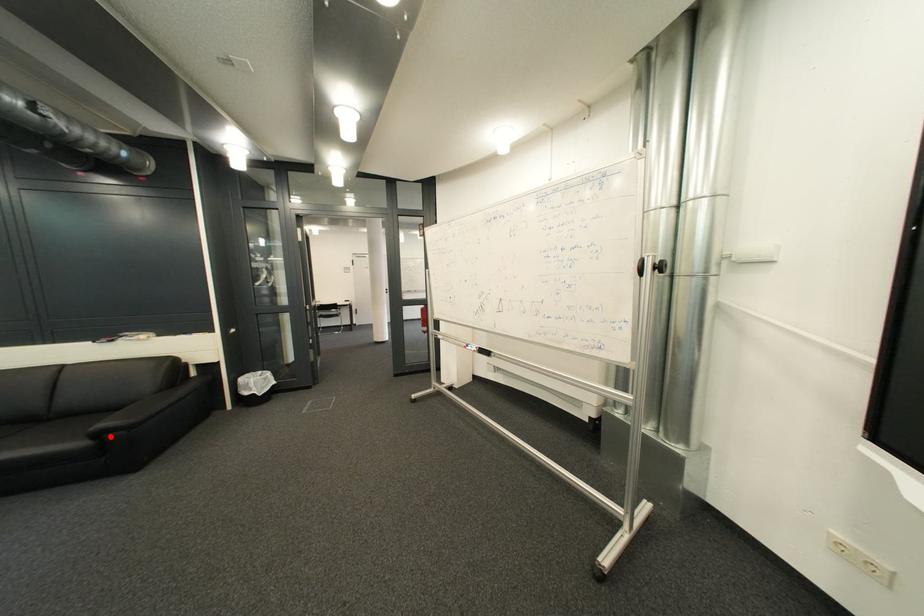
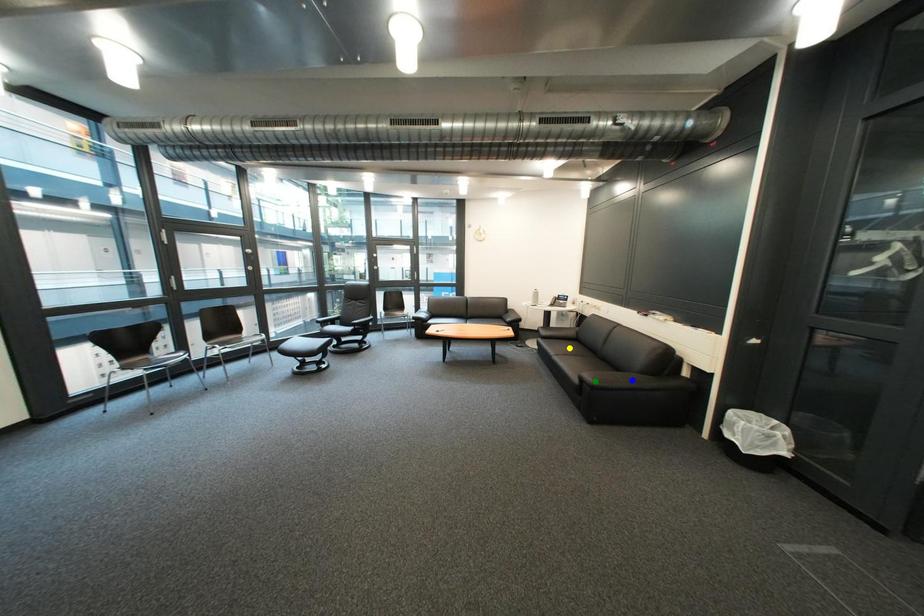
Question: I am providing you with two images of the same scene from different viewpoints. A red point is marked on the first image. You are given multiple points on the second image. In image 2, which mark is for the same physical point as the one in image 1?

Choices:
 (A) blue point
 (B) yellow point
 (C) green point

Answer: (C)